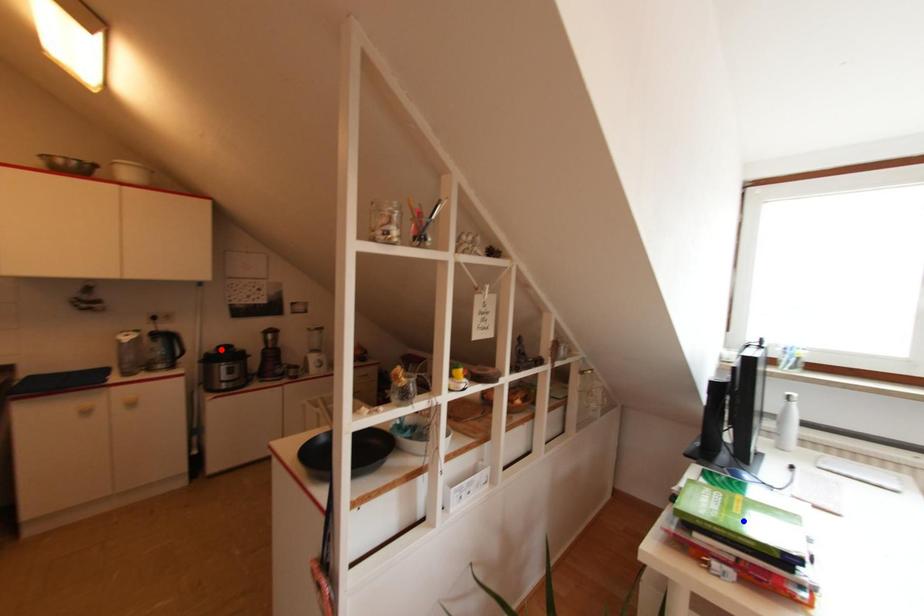
Question: In the image, two points are highlighted. Which point is nearer to the camera? Reply with the corresponding letter.

Choices:
 (A) blue point
 (B) red point

Answer: (A)